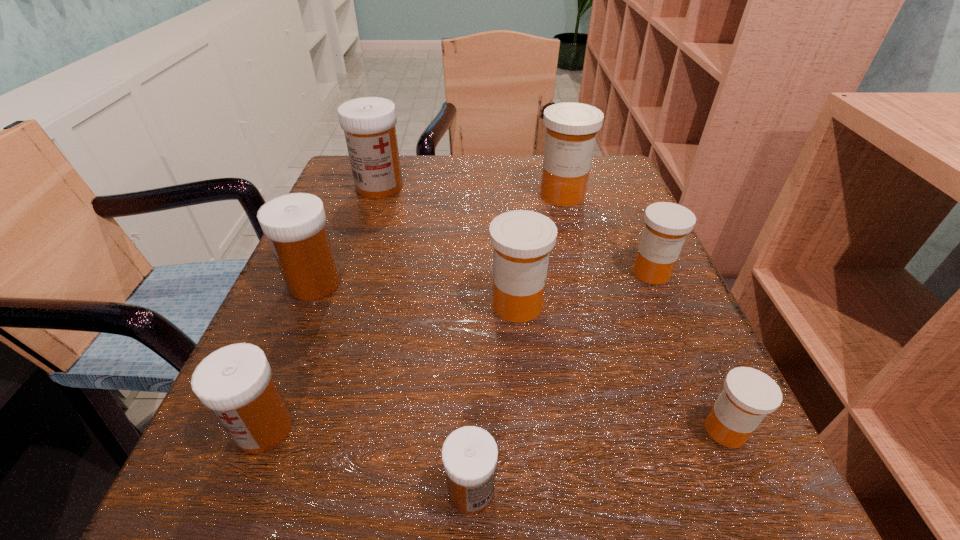
Where is `free space that satisfies the following two spatial constraints: 1. on the label of the leftmost orange medicine; 2. on the front side of the third biggest white medicine`? The width and height of the screenshot is (960, 540). free space that satisfies the following two spatial constraints: 1. on the label of the leftmost orange medicine; 2. on the front side of the third biggest white medicine is located at coordinates (528, 428).

Where is `free space that satisfies the following two spatial constraints: 1. on the back side of the biggest white medicine; 2. on the left side of the second biggest white medicine`? This screenshot has height=540, width=960. free space that satisfies the following two spatial constraints: 1. on the back side of the biggest white medicine; 2. on the left side of the second biggest white medicine is located at coordinates (354, 187).

The width and height of the screenshot is (960, 540). In order to click on free space that satisfies the following two spatial constraints: 1. on the front side of the second nearest white medicine; 2. on the right side of the nearest object in this screenshot , I will do (240, 491).